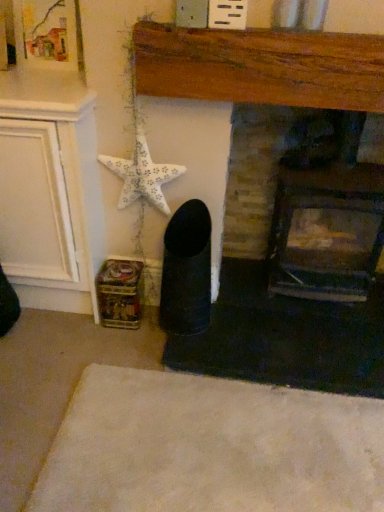
Question: Considering the positions of dark brick fireplace at center, the 1th fireplace from the right, and wooden fireplace at center, which is counted as the 2th fireplace, starting from the right, in the image, is dark brick fireplace at center, the 1th fireplace from the right, bigger or smaller than wooden fireplace at center, which is counted as the 2th fireplace, starting from the right,?

Choices:
 (A) big
 (B) small

Answer: (A)

Question: Is dark brick fireplace at center, the 2th fireplace when ordered from left to right, spatially inside wooden fireplace at center, which is counted as the 2th fireplace, starting from the right, or outside of it?

Choices:
 (A) outside
 (B) inside

Answer: (A)

Question: Estimate the real-world distances between objects in this image. Which object is farther from the dark brick fireplace at center, the 2th fireplace when ordered from left to right?

Choices:
 (A) white matte starfish at upper left
 (B) wooden fireplace at center, which is counted as the 2th fireplace, starting from the right
 (C) white soft rug at lower center

Answer: (C)

Question: Considering the real-world distances, which object is farthest from the dark brick fireplace at center, the 1th fireplace from the right?

Choices:
 (A) white matte starfish at upper left
 (B) wooden fireplace at center, which is counted as the 2th fireplace, starting from the right
 (C) white soft rug at lower center

Answer: (C)